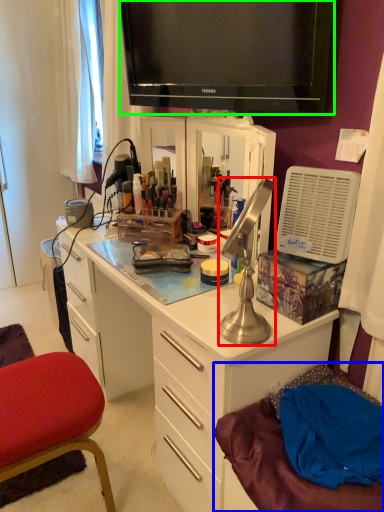
Question: Estimate the real-world distances between objects in this image. Which object is farther from lamp (highlighted by a red box), wide (highlighted by a blue box) or television (highlighted by a green box)?

Choices:
 (A) wide
 (B) television

Answer: (B)